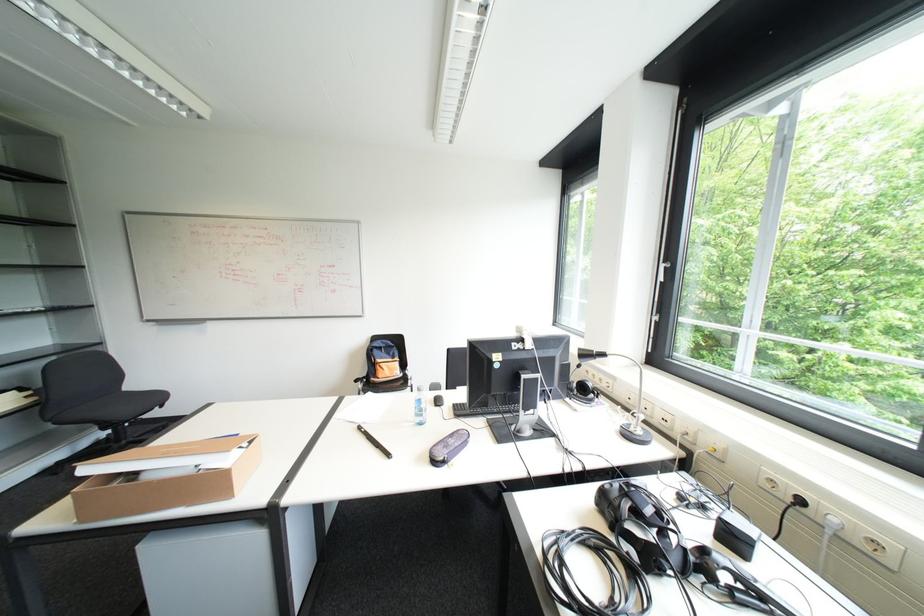
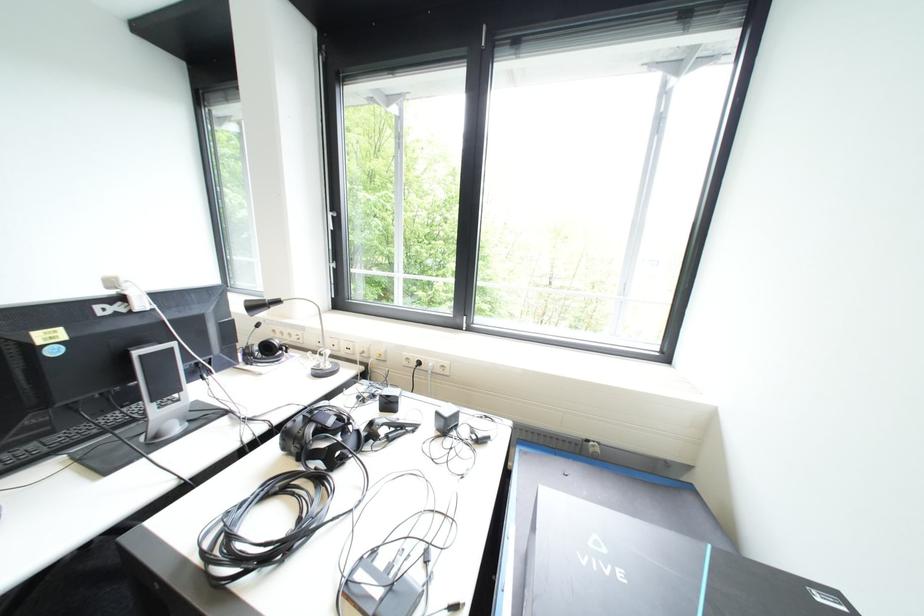
Question: How did the camera likely rotate?

Choices:
 (A) Left
 (B) Right
 (C) Up
 (D) Down

Answer: (B)